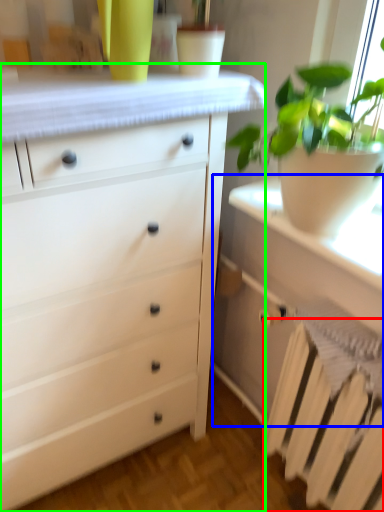
Question: Estimate the real-world distances between objects in this image. Which object is farther from radiator (highlighted by a red box), vanity (highlighted by a blue box) or chest of drawers (highlighted by a green box)?

Choices:
 (A) vanity
 (B) chest of drawers

Answer: (B)